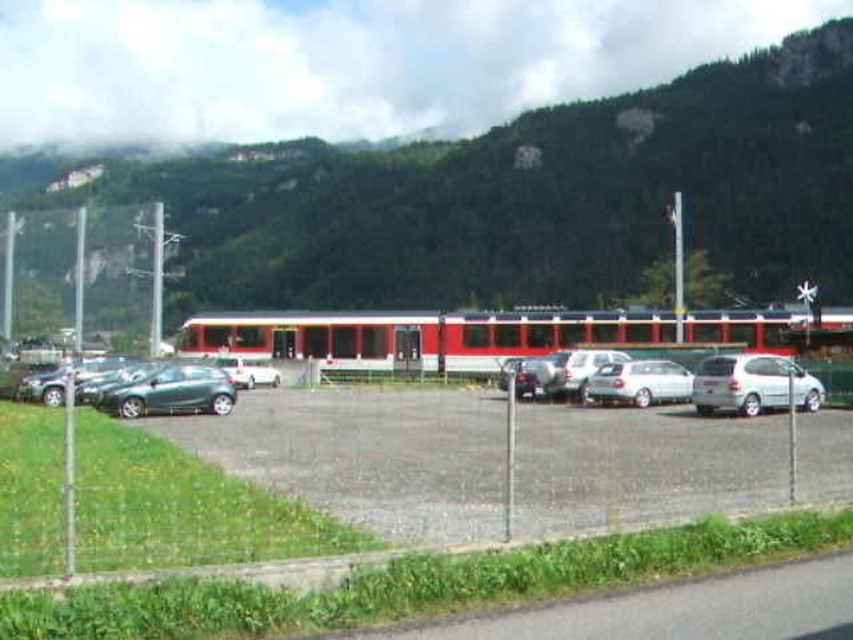
Is red matte train at center to the right of metallic gray hatchback at lower left from the viewer's perspective?

Yes, red matte train at center is to the right of metallic gray hatchback at lower left.

Does red matte train at center have a lesser height compared to metallic gray hatchback at lower left?

No.

Is point (830, 314) positioned behind point (184, 365)?

Yes, point (830, 314) is behind point (184, 365).

Identify the location of red matte train at center. This screenshot has height=640, width=853. (468, 336).

Is metallic gray hatchback at lower left further to camera compared to white matte car at center?

No, it is in front of white matte car at center.

Between point (183, 394) and point (260, 371), which one is positioned behind?

The point (260, 371) is more distant.

Where is `metallic gray hatchback at lower left`? The image size is (853, 640). metallic gray hatchback at lower left is located at coordinates (171, 392).

Who is taller, metallic silver sedan at center or white matte car at center?

metallic silver sedan at center is taller.

Which is below, metallic silver sedan at center or white matte car at center?

white matte car at center is below.

This screenshot has height=640, width=853. I want to click on metallic silver sedan at center, so click(x=531, y=374).